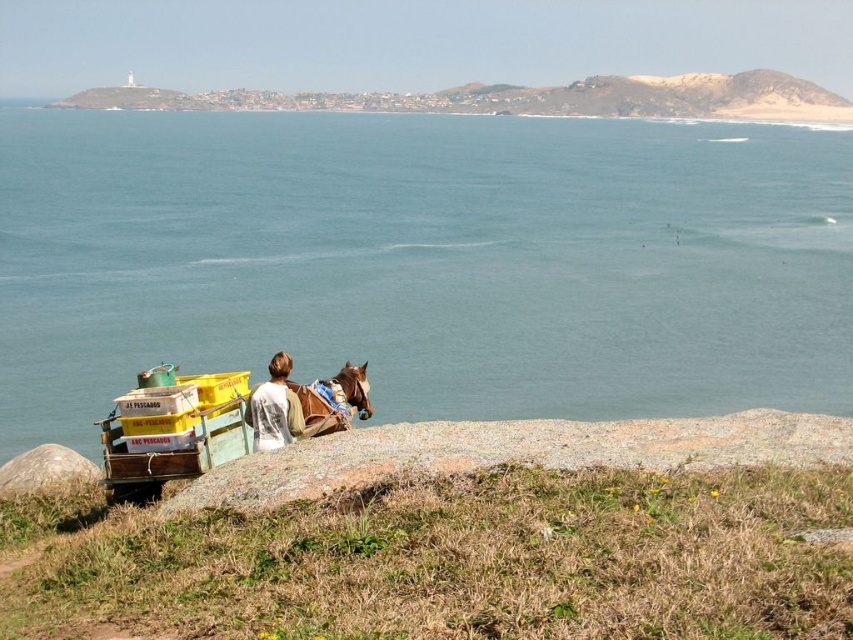
Is smooth sand dunes at upper center above white cotton shirt at lower center?

Correct, smooth sand dunes at upper center is located above white cotton shirt at lower center.

Which is more to the right, smooth sand dunes at upper center or white cotton shirt at lower center?

smooth sand dunes at upper center

Which is in front, point (624, 93) or point (263, 422)?

Positioned in front is point (263, 422).

Where is `smooth sand dunes at upper center`? smooth sand dunes at upper center is located at coordinates (525, 99).

Is point (142, 372) farther from viewer compared to point (312, 419)?

No, (142, 372) is in front of (312, 419).

Who is more forward, (199,392) or (354,392)?

Point (199,392) is in front.

Where is `yellow plastic wagon at lower left`? yellow plastic wagon at lower left is located at coordinates (173, 436).

Which is in front, point (317, 416) or point (256, 440)?

Positioned in front is point (256, 440).

Between point (323, 428) and point (282, 364), which one is positioned behind?

The point (323, 428) is more distant.

You are a GUI agent. You are given a task and a screenshot of the screen. Output one action in this format:
    pyautogui.click(x=<x>, y=<y>)
    Task: Click on the brown glossy horse at center
    The width and height of the screenshot is (853, 640).
    Given the screenshot: What is the action you would take?
    pyautogui.click(x=334, y=401)